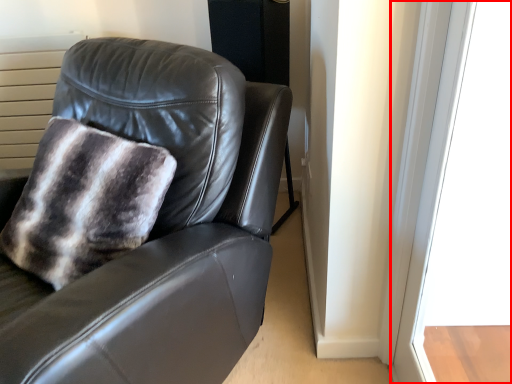
Question: Observing the image, what is the correct spatial positioning of window (annotated by the red box) in reference to chair?

Choices:
 (A) left
 (B) right

Answer: (B)